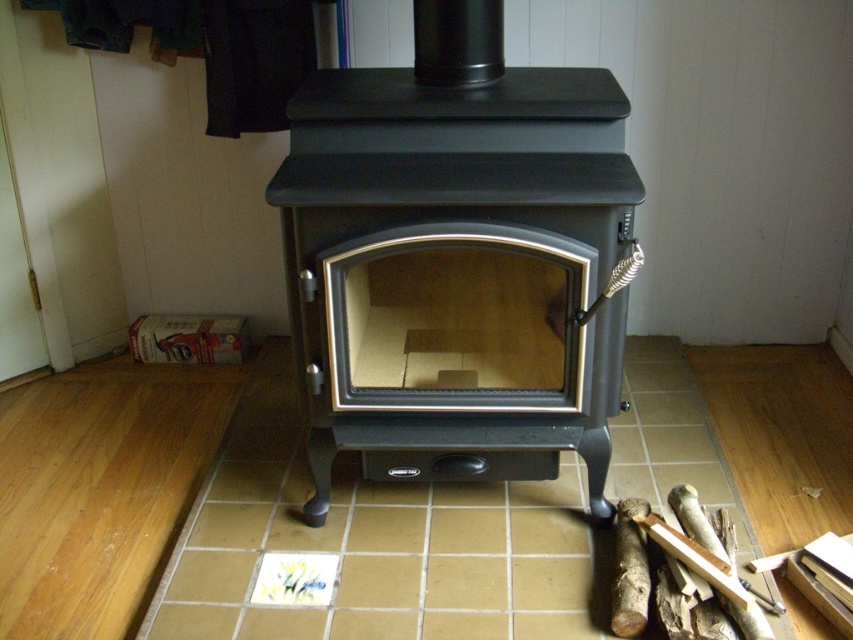
You are standing in the room and want to place a new log into the matte black stove at center. Given that the brown wood log at lower right is your only available fuel, can you easily reach it from your current position without moving closer to the stove?

The matte black stove at center is closer to the viewer than the brown wood log at lower right. Since the log is positioned further away, you would need to move closer to the stove or the log to reach it, so it might not be easily accessible from your current position.

You are standing in the room and want to place a new rug exactly at the location of the matte black stove at center. What are the coordinates where you should place the rug?

The coordinates for placing the rug exactly at the location of the matte black stove at center are point [456,352].